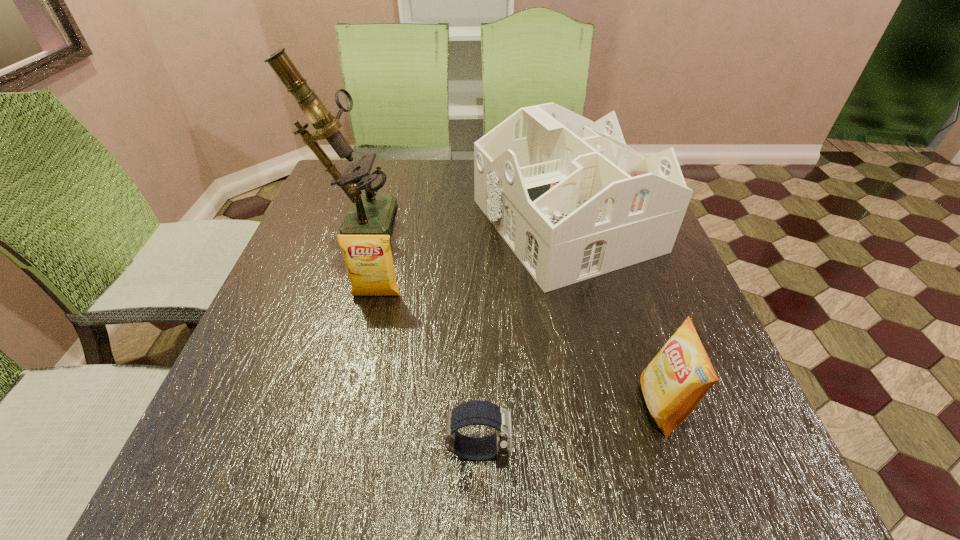
The image size is (960, 540). I want to click on empty space between the shortest object and the left crisp (potato chip), so click(427, 373).

In order to click on free space between the farther crisp (potato chip) and the fourth shortest object in this screenshot , I will do `click(470, 260)`.

You are a GUI agent. You are given a task and a screenshot of the screen. Output one action in this format:
    pyautogui.click(x=<x>, y=<y>)
    Task: Click on the free space between the second tallest object and the shortest object
    This screenshot has height=540, width=960.
    Given the screenshot: What is the action you would take?
    pyautogui.click(x=522, y=336)

I want to click on object that ranks as the closest to the tallest object, so click(368, 258).

Where is `the third closest object to the microscope`? The width and height of the screenshot is (960, 540). the third closest object to the microscope is located at coordinates (477, 412).